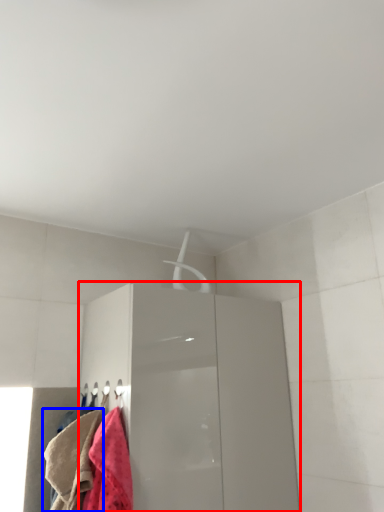
Question: Which object appears farthest to the camera in this image, cabinetry (highlighted by a red box) or towel (highlighted by a blue box)?

Choices:
 (A) cabinetry
 (B) towel

Answer: (A)